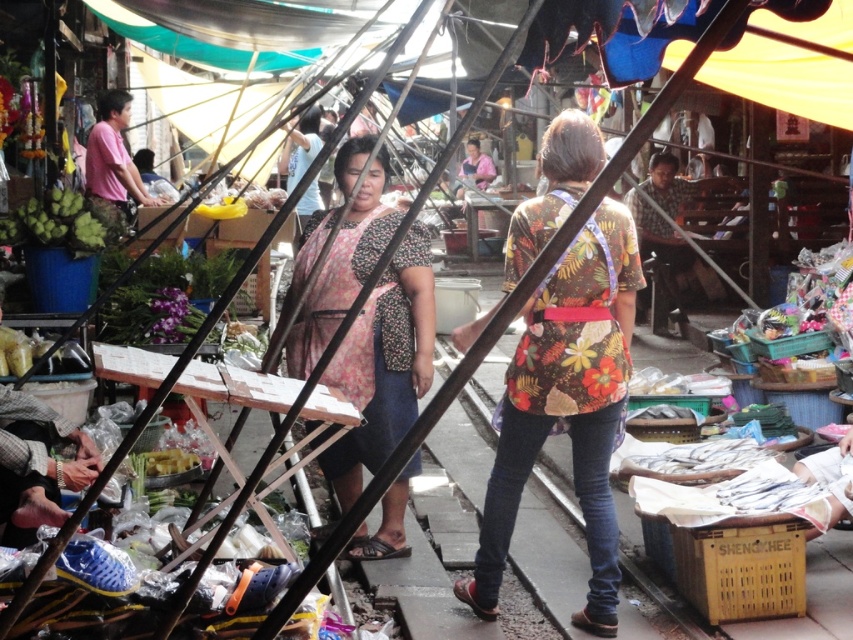
Who is more distant from viewer, (490,584) or (347,556)?

Positioned behind is point (347,556).

Can you confirm if floral fabric shirt at center is wider than floral fabric dress at center?

Yes, floral fabric shirt at center is wider than floral fabric dress at center.

Locate an element on the screen. The width and height of the screenshot is (853, 640). floral fabric shirt at center is located at coordinates (566, 406).

Find the location of a particular element. The image size is (853, 640). floral fabric shirt at center is located at coordinates (566, 406).